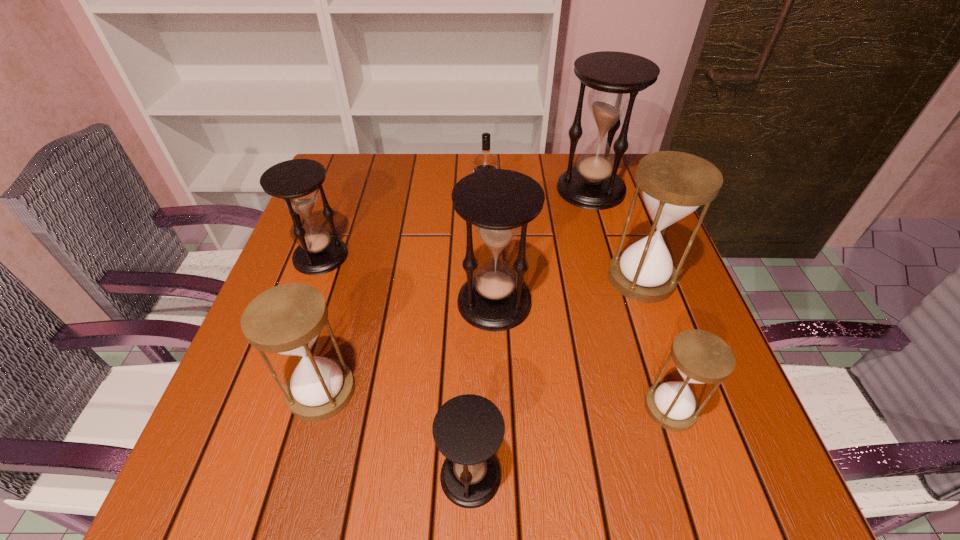
Identify the location of free space between the farthest white hourglass and the tallest object. (616, 234).

At what (x,y) coordinates should I click in order to perform the action: click on free spot between the second biggest black hourglass and the smallest white hourglass. Please return your answer as a coordinate pair (x, y). Looking at the image, I should click on (583, 355).

Where is `free area in between the tallest object and the nearest hourglass`? free area in between the tallest object and the nearest hourglass is located at coordinates (531, 333).

The width and height of the screenshot is (960, 540). Identify the location of free spot between the farthest black hourglass and the second smallest white hourglass. (456, 290).

Image resolution: width=960 pixels, height=540 pixels. I want to click on vacant space that is in between the third smallest black hourglass and the farthest hourglass, so click(542, 246).

At what (x,y) coordinates should I click in order to perform the action: click on vacant area between the tallest object and the biggest white hourglass. Please return your answer as a coordinate pair (x, y). Image resolution: width=960 pixels, height=540 pixels. Looking at the image, I should click on (616, 234).

At what (x,y) coordinates should I click in order to perform the action: click on free spot between the farthest white hourglass and the second biggest white hourglass. Please return your answer as a coordinate pair (x, y). The width and height of the screenshot is (960, 540). Looking at the image, I should click on (482, 335).

Locate an element on the screen. Image resolution: width=960 pixels, height=540 pixels. object that is the fourth closest to the second biggest black hourglass is located at coordinates coord(701,357).

Locate which object ranks sixth in proximity to the vodka. Please provide its 2D coordinates. Your answer should be formatted as a tuple, i.e. [(x, y)], where the tuple contains the x and y coordinates of a point satisfying the conditions above.

[(701, 357)]

Identify which hourglass is the second nearest to the third biggest black hourglass. Please provide its 2D coordinates. Your answer should be formatted as a tuple, i.e. [(x, y)], where the tuple contains the x and y coordinates of a point satisfying the conditions above.

[(498, 202)]